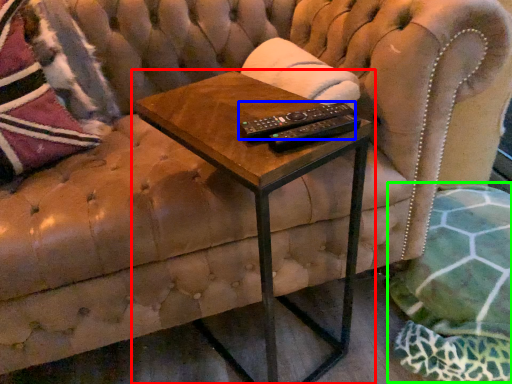
Question: Based on their relative distances, which object is farther from table (highlighted by a red box)? Choose from control (highlighted by a blue box) and swivel chair (highlighted by a green box).

Choices:
 (A) control
 (B) swivel chair

Answer: (B)